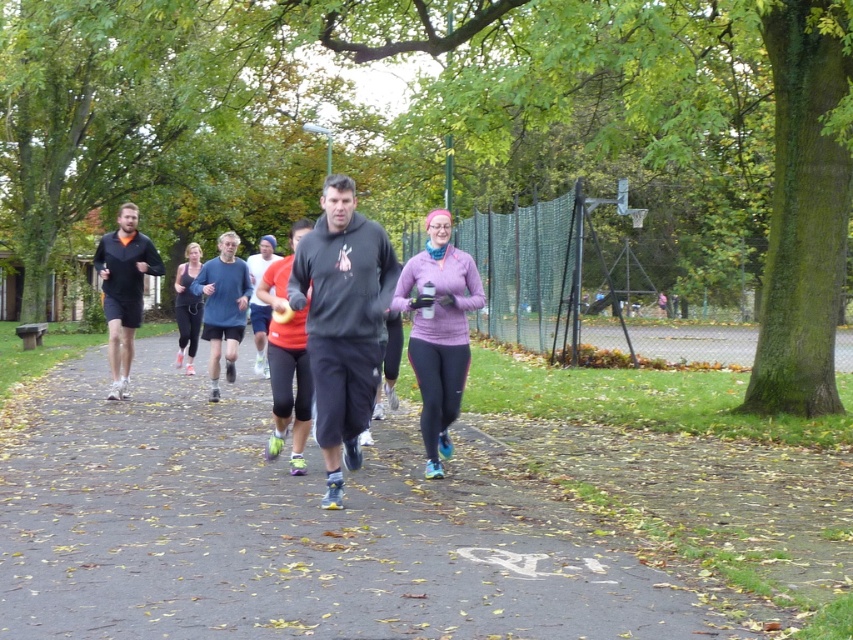
You are a photographer standing at the edge of the path. You want to take a photo that includes both the matte blue top at center and the matte black leggings at center. Given that your camera has a maximum focus range of 3 meters, will both subjects be in focus?

The distance between the matte blue top at center and the matte black leggings at center is 3.06 meters. Since the camera can only focus up to 3 meters, the subjects are slightly out of the focus range. Therefore, both subjects may not be in focus simultaneously.

Looking at this image, you are planning to place a small bench on the smooth asphalt path at center. To ensure it doesn not obstruct the path, where should you place it relative to the path?

The bench should be placed off the smooth asphalt path at center to avoid obstructing it.